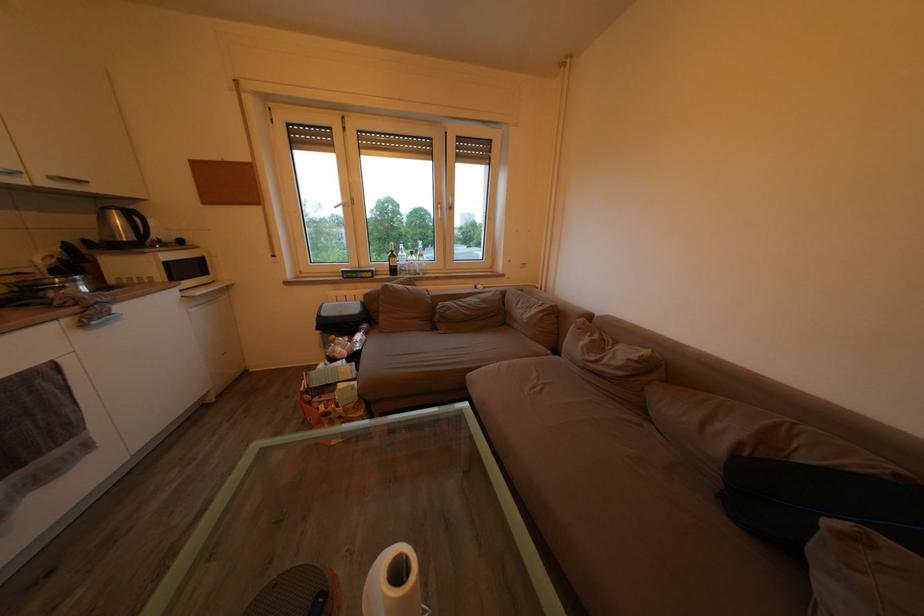
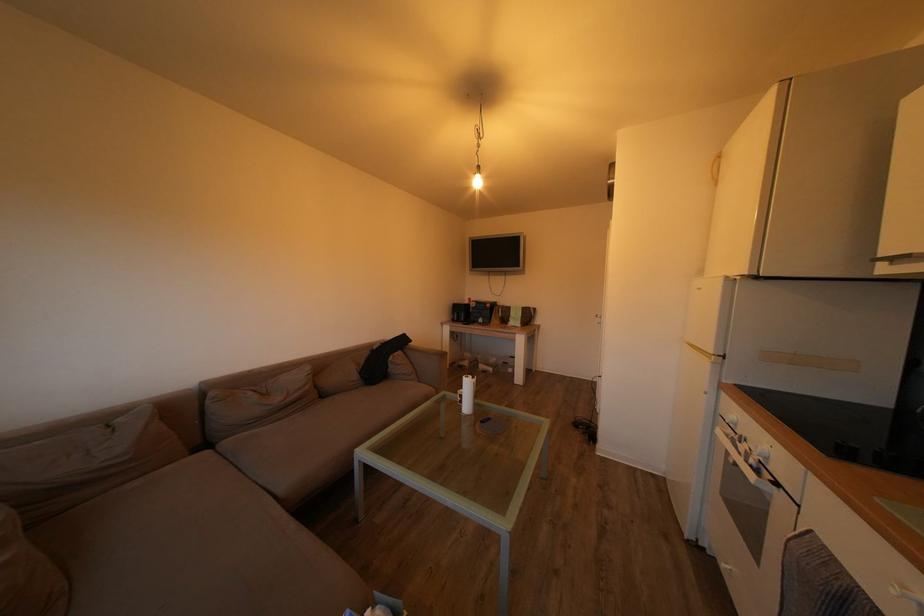
The point at (726, 455) is marked in the first image. Where is the corresponding point in the second image?

(362, 382)